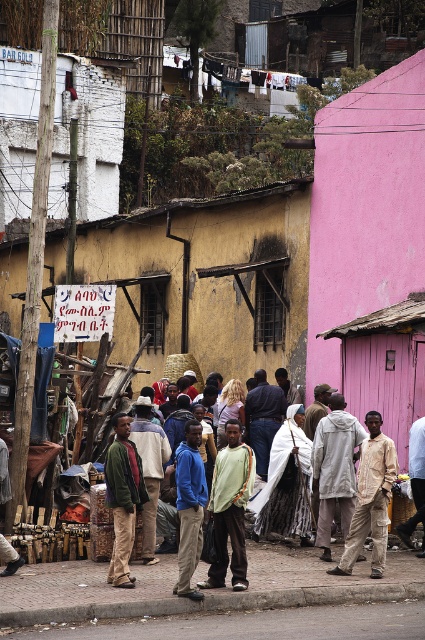
Question: Among these points, which one is nearest to the camera?

Choices:
 (A) (326, 140)
 (B) (286, 490)

Answer: (B)

Question: Can you confirm if camouflage pants at center is bigger than light brown leather jacket at center?

Choices:
 (A) no
 (B) yes

Answer: (B)

Question: Which of these objects is positioned farthest from the white fur coat at center?

Choices:
 (A) light brown leather jacket at center
 (B) blue matte jacket at center

Answer: (B)

Question: Does pink matte hut at center-right appear on the right side of light gray hoodie at center?

Choices:
 (A) yes
 (B) no

Answer: (A)

Question: Estimate the real-world distances between objects in this image. Which object is farther from the white fur coat at center?

Choices:
 (A) light brown leather jacket at center
 (B) camouflage pants at center
 (C) light green fabric shirt at center

Answer: (B)

Question: Is pink matte hut at center-right smaller than light brown striped shirt at center?

Choices:
 (A) yes
 (B) no

Answer: (B)